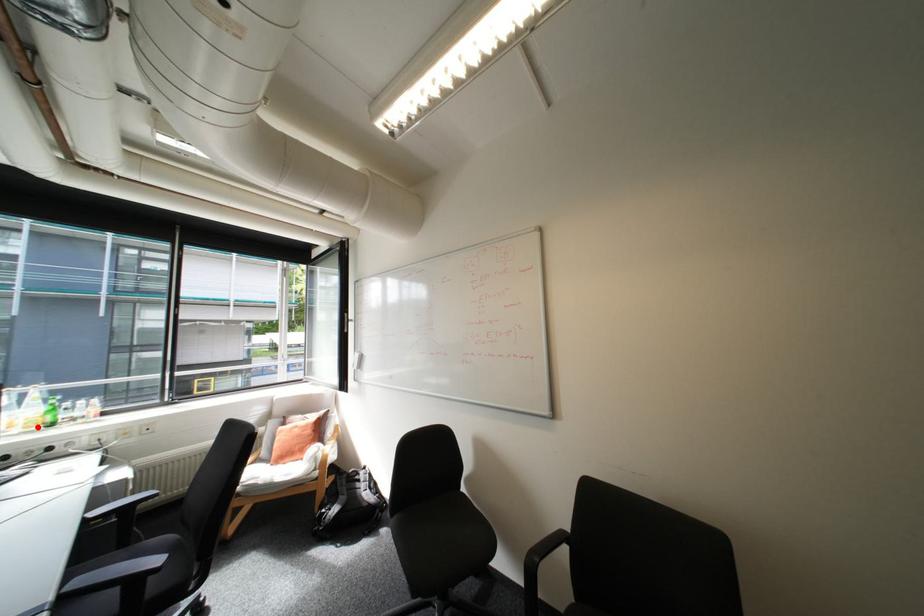
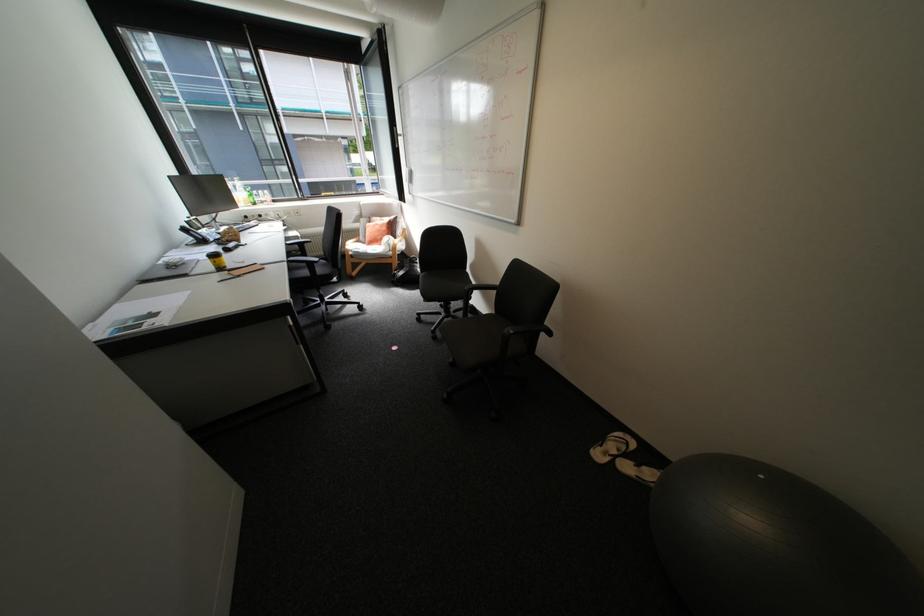
Question: I am providing you with two images of the same scene from different viewpoints. A red point is marked on the first image. At the location where the point appears in image 1, is it still visible in image 2?

Choices:
 (A) Yes
 (B) No

Answer: (A)